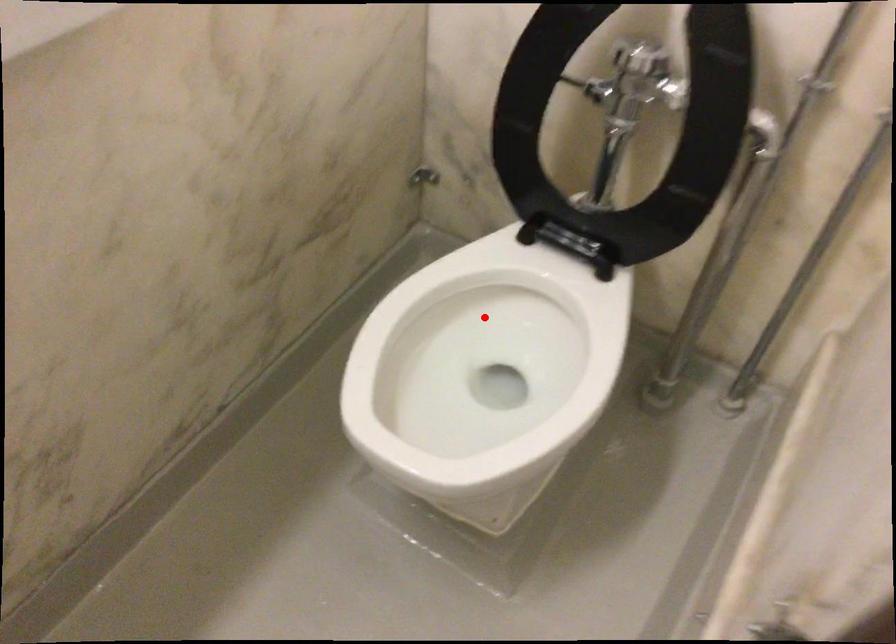
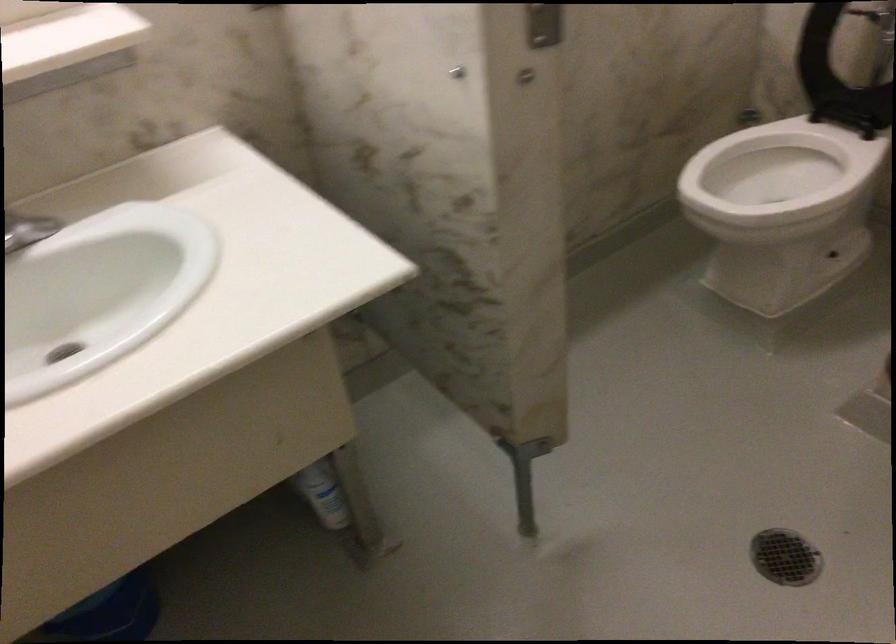
Question: A red point is marked in image1. In image2, is the corresponding 3D point closer to the camera or farther? Reply with the corresponding letter.

Choices:
 (A) The corresponding 3D point is closer.
 (B) The corresponding 3D point is farther.

Answer: (B)